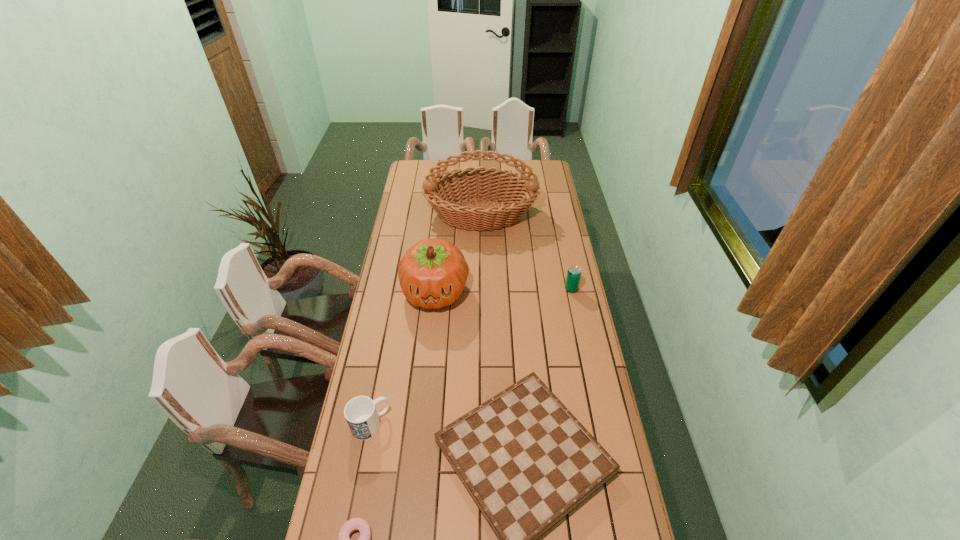
This screenshot has height=540, width=960. I want to click on pumpkin that is positioned at the left edge, so click(x=432, y=274).

Image resolution: width=960 pixels, height=540 pixels. Identify the location of mug at the left edge. (360, 412).

Find the location of a particular element. The image size is (960, 540). basket that is at the right edge is located at coordinates (443, 192).

You are a GUI agent. You are given a task and a screenshot of the screen. Output one action in this format:
    pyautogui.click(x=<x>, y=<y>)
    Task: Click on the beer can that is at the right edge
    This screenshot has height=540, width=960.
    Given the screenshot: What is the action you would take?
    pyautogui.click(x=574, y=273)

In the image, there is a desktop. Where is `free region at the left edge`? free region at the left edge is located at coordinates (367, 452).

Identify the location of free location at the right edge of the desktop. (559, 318).

This screenshot has width=960, height=540. In order to click on vacant space at the far right corner of the desktop in this screenshot , I will do `click(547, 178)`.

Identify the location of free space between the mug and the fifth shortest object. Image resolution: width=960 pixels, height=540 pixels. (402, 358).

The image size is (960, 540). Find the location of `free point between the mug and the farthest object`. free point between the mug and the farthest object is located at coordinates (425, 320).

You are a GUI agent. You are given a task and a screenshot of the screen. Output one action in this format:
    pyautogui.click(x=<x>, y=<y>)
    Task: Click on the object that stands as the third closest to the farthest object
    
    Given the screenshot: What is the action you would take?
    pyautogui.click(x=524, y=458)